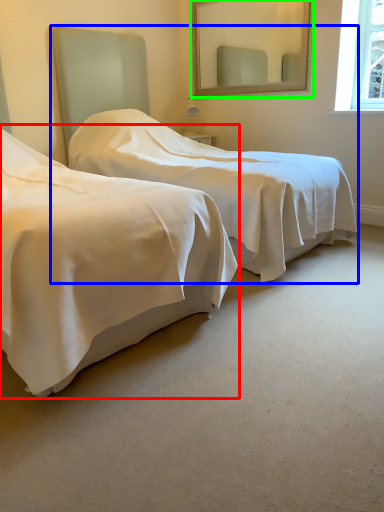
Question: Estimate the real-world distances between objects in this image. Which object is farther from bed (highlighted by a red box), bed (highlighted by a blue box) or mirror (highlighted by a green box)?

Choices:
 (A) bed
 (B) mirror

Answer: (B)